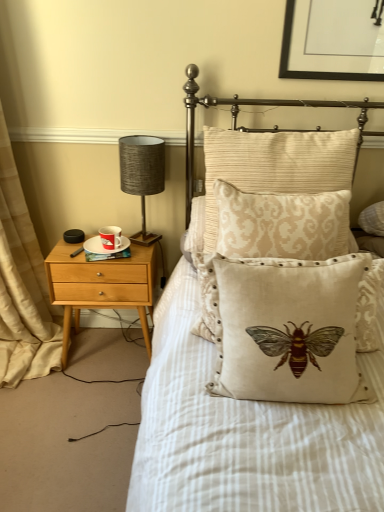
Question: Does beige damask pillow at center, the 1th pillow when ordered from back to front, have a greater width compared to white ceramic saucer at left?

Choices:
 (A) yes
 (B) no

Answer: (A)

Question: Is beige damask pillow at center, the 1th pillow when ordered from back to front, looking in the opposite direction of white ceramic saucer at left?

Choices:
 (A) yes
 (B) no

Answer: (B)

Question: From the image's perspective, is beige damask pillow at center, which ranks as the 3th pillow in front-to-back order, below white ceramic saucer at left?

Choices:
 (A) no
 (B) yes

Answer: (A)

Question: Is beige damask pillow at center, the 1th pillow when ordered from back to front, bigger than white ceramic saucer at left?

Choices:
 (A) yes
 (B) no

Answer: (A)

Question: Is beige damask pillow at center, the 1th pillow when ordered from back to front, not within white ceramic saucer at left?

Choices:
 (A) no
 (B) yes

Answer: (B)

Question: Considering the positions of beige damask pillow at center, the second pillow positioned from the front, and red glossy mug at left in the image, is beige damask pillow at center, the second pillow positioned from the front, taller or shorter than red glossy mug at left?

Choices:
 (A) tall
 (B) short

Answer: (A)

Question: Is beige damask pillow at center, the second pillow positioned from the front, bigger or smaller than red glossy mug at left?

Choices:
 (A) big
 (B) small

Answer: (A)

Question: From a real-world perspective, is beige damask pillow at center, the second pillow positioned from the front, positioned above or below red glossy mug at left?

Choices:
 (A) above
 (B) below

Answer: (A)

Question: Is beige damask pillow at center, which is the 2th pillow in back-to-front order, inside or outside of red glossy mug at left?

Choices:
 (A) outside
 (B) inside

Answer: (A)

Question: Is red glossy mug at left inside the boundaries of beige fabric curtain at left, or outside?

Choices:
 (A) outside
 (B) inside

Answer: (A)

Question: Relative to beige fabric curtain at left, is red glossy mug at left in front or behind?

Choices:
 (A) front
 (B) behind

Answer: (B)

Question: From the image's perspective, relative to beige fabric curtain at left, is red glossy mug at left above or below?

Choices:
 (A) below
 (B) above

Answer: (A)

Question: Is red glossy mug at left wider or thinner than beige fabric curtain at left?

Choices:
 (A) thin
 (B) wide

Answer: (A)

Question: From the image's perspective, relative to red glossy mug at left, is textured gray lampshade at left above or below?

Choices:
 (A) above
 (B) below

Answer: (A)

Question: Visually, is textured gray lampshade at left positioned to the left or to the right of red glossy mug at left?

Choices:
 (A) right
 (B) left

Answer: (A)